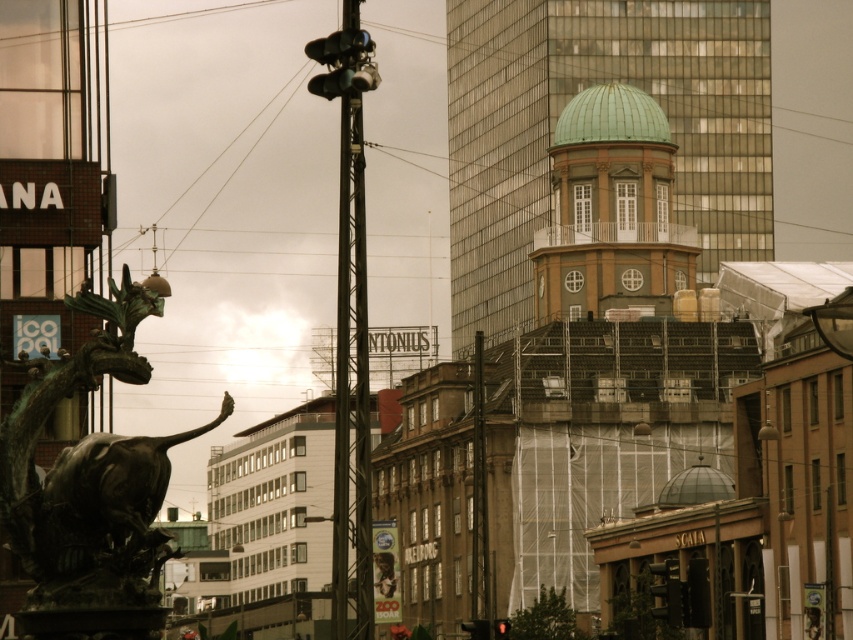
Question: Is green glass dome at upper center behind green patina bronze bull at lower left?

Choices:
 (A) no
 (B) yes

Answer: (B)

Question: Which of the following is the farthest from the observer?

Choices:
 (A) green patina bronze bull at lower left
 (B) green glass dome at upper center
 (C) green copper dome at upper center

Answer: (B)

Question: Which point is closer to the camera?

Choices:
 (A) green glass dome at upper center
 (B) green copper dome at upper center
 (C) green patina bronze bull at lower left

Answer: (C)

Question: Which object is closer to the camera taking this photo?

Choices:
 (A) green patina bronze bull at lower left
 (B) green copper dome at upper center
 (C) green glass dome at upper center

Answer: (A)

Question: Does green patina bronze bull at lower left appear under green copper dome at upper center?

Choices:
 (A) yes
 (B) no

Answer: (A)

Question: In this image, where is green glass dome at upper center located relative to green patina bronze bull at lower left?

Choices:
 (A) above
 (B) below

Answer: (A)